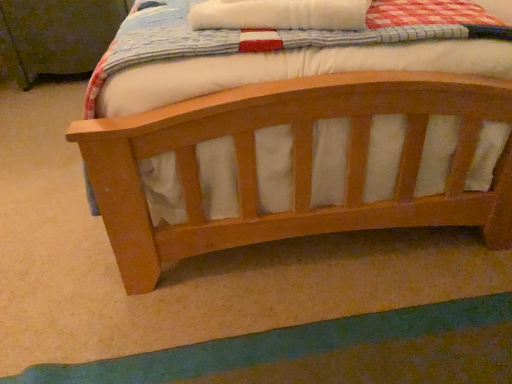
Locate an element on the screen. This screenshot has height=384, width=512. vacant space in front of wooden changing table at upper left is located at coordinates (36, 109).